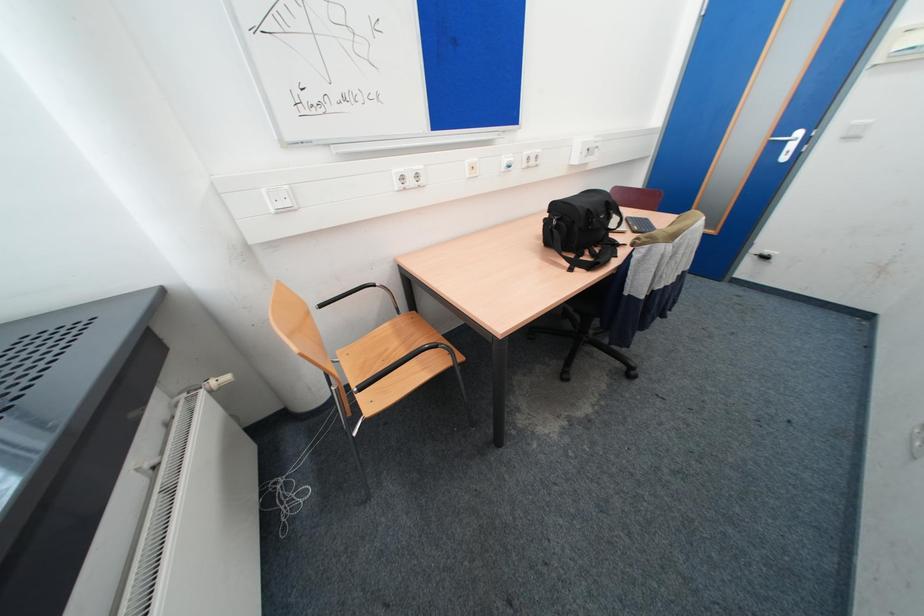
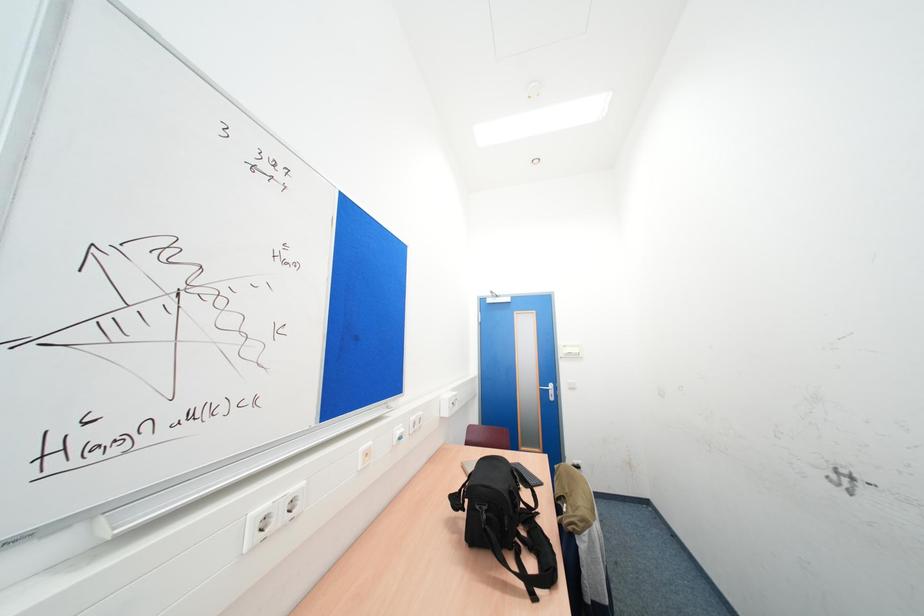
The first image is from the beginning of the video and the second image is from the end. How did the camera likely rotate when shooting the video?

The rotation direction of the camera is right-up.